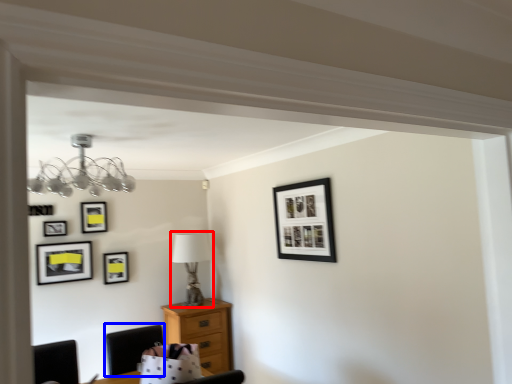
Question: Which object is closer to the camera taking this photo, table lamp (highlighted by a red box) or chair (highlighted by a blue box)?

Choices:
 (A) table lamp
 (B) chair

Answer: (B)